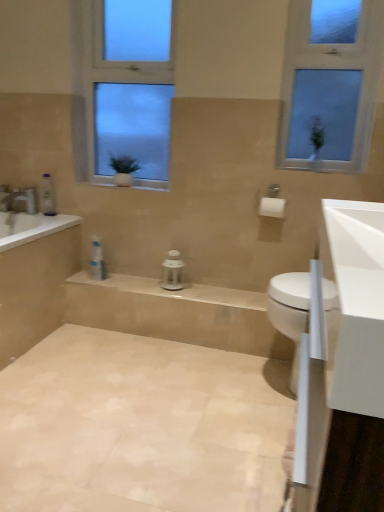
Question: Should I look upward or downward to see white glossy sink at right?

Choices:
 (A) up
 (B) down

Answer: (B)

Question: Is beige tile bath at lower left positioned in front of clear glass window at center, acting as the 1th window starting from the left?

Choices:
 (A) yes
 (B) no

Answer: (A)

Question: Is beige tile bath at lower left positioned behind clear glass window at center, acting as the 1th window starting from the left?

Choices:
 (A) yes
 (B) no

Answer: (B)

Question: Does beige tile bath at lower left have a greater height compared to clear glass window at center, the second window viewed from the right?

Choices:
 (A) no
 (B) yes

Answer: (A)

Question: Does beige tile bath at lower left have a lesser width compared to clear glass window at center, acting as the 1th window starting from the left?

Choices:
 (A) yes
 (B) no

Answer: (B)

Question: Does beige tile bath at lower left have a larger size compared to clear glass window at center, acting as the 1th window starting from the left?

Choices:
 (A) yes
 (B) no

Answer: (A)

Question: Does beige tile bath at lower left touch clear glass window at center, acting as the 1th window starting from the left?

Choices:
 (A) yes
 (B) no

Answer: (B)

Question: Could clear glass window at upper right, the 1th window positioned from the right, be considered to be inside white glossy bathtub at left?

Choices:
 (A) yes
 (B) no

Answer: (B)

Question: From the image's perspective, does white glossy bathtub at left appear lower than clear glass window at upper right, the 1th window positioned from the right?

Choices:
 (A) no
 (B) yes

Answer: (B)

Question: Does white glossy bathtub at left have a lesser height compared to clear glass window at upper right, the 1th window positioned from the right?

Choices:
 (A) yes
 (B) no

Answer: (A)

Question: Are white glossy bathtub at left and clear glass window at upper right, the 1th window positioned from the right, located far from each other?

Choices:
 (A) yes
 (B) no

Answer: (A)

Question: Is white glossy bathtub at left taller than clear glass window at upper right, the 1th window positioned from the right?

Choices:
 (A) no
 (B) yes

Answer: (A)

Question: Is white glossy bathtub at left not within clear glass window at upper right, the 1th window positioned from the right?

Choices:
 (A) no
 (B) yes

Answer: (B)

Question: Is the depth of white glossy bathtub at left less than that of beige tile bath at lower left?

Choices:
 (A) no
 (B) yes

Answer: (A)